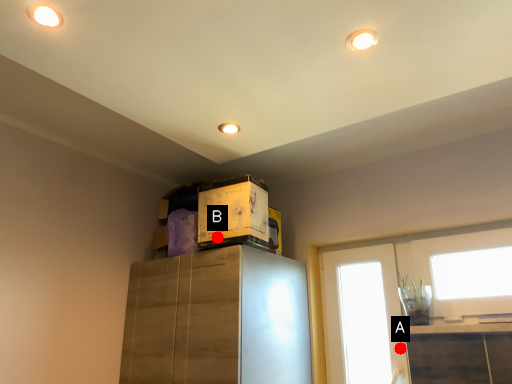
Question: Two points are circled on the image, labeled by A and B beside each circle. Which point is closer to the camera taking this photo?

Choices:
 (A) A is closer
 (B) B is closer

Answer: (B)